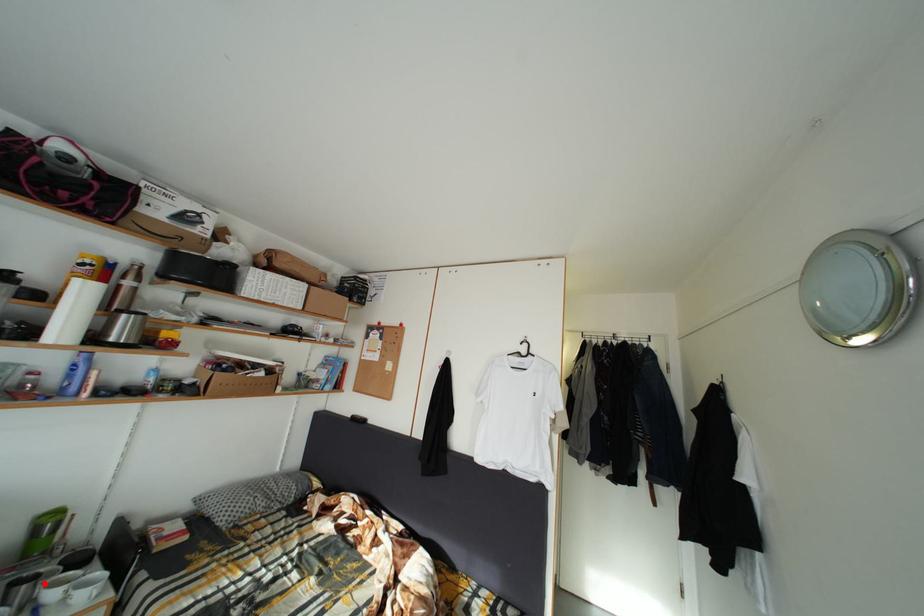
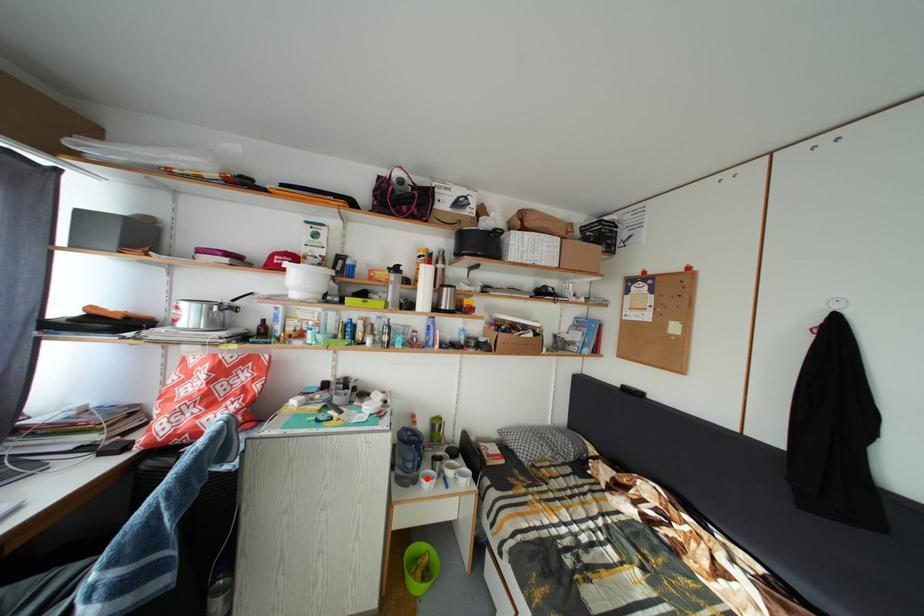
I am providing you with two images of the same scene from different viewpoints. A red point is marked on the first image and another point is marked on the second image. Is the red point in image1 aligned with the point shown in image2?

No